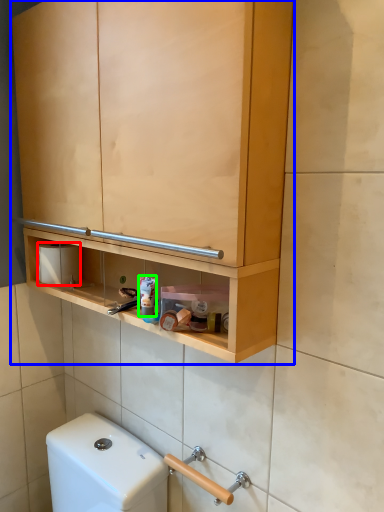
Question: Estimate the real-world distances between objects in this image. Which object is closer to toilet paper (highlighted by a red box), cabinetry (highlighted by a blue box) or toiletry (highlighted by a green box)?

Choices:
 (A) cabinetry
 (B) toiletry

Answer: (B)